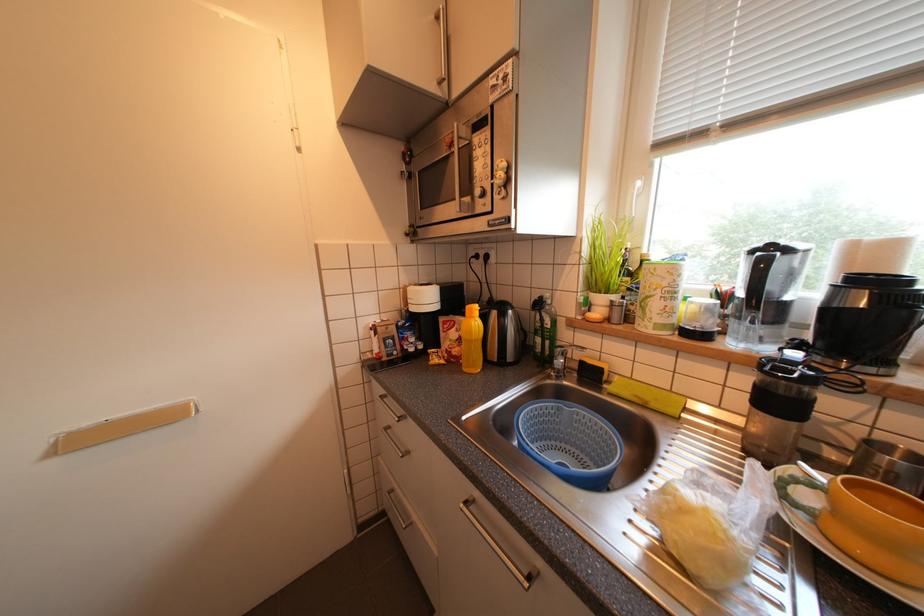
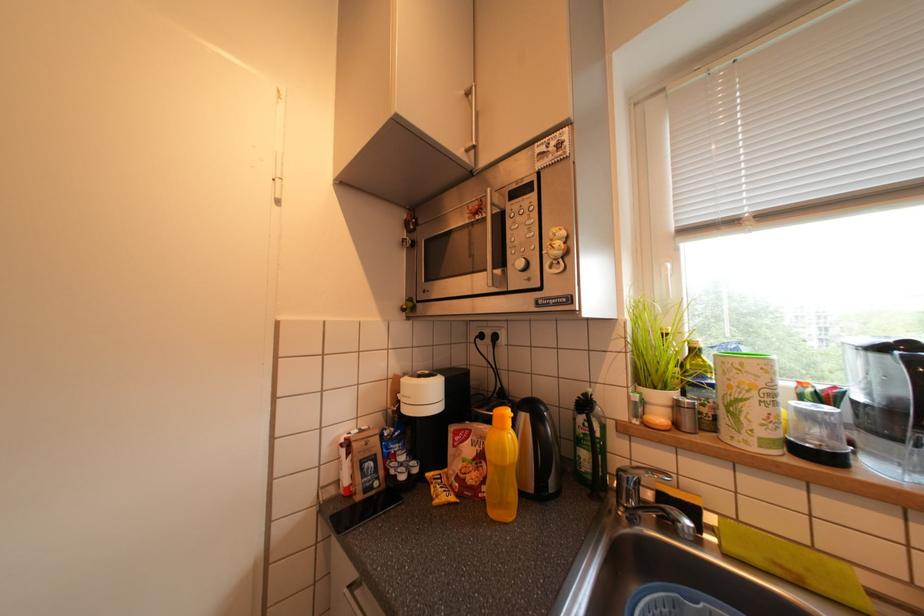
Question: The images are taken continuously from a first-person perspective. In which direction is your viewpoint rotating?

Choices:
 (A) Left
 (B) Right
 (C) Up
 (D) Down

Answer: (C)